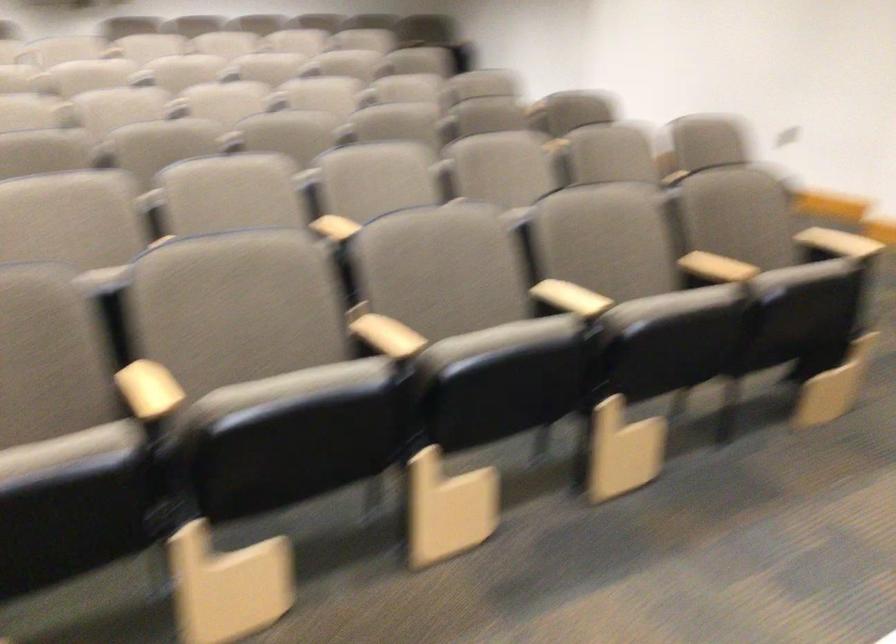
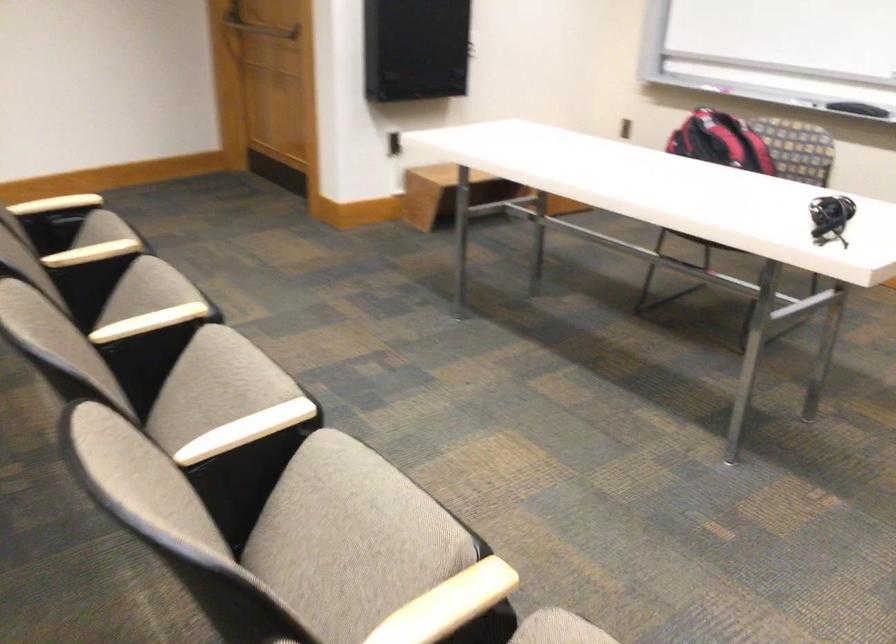
Where in the second image is the point corresponding to point 657,301 from the first image?

(147, 290)